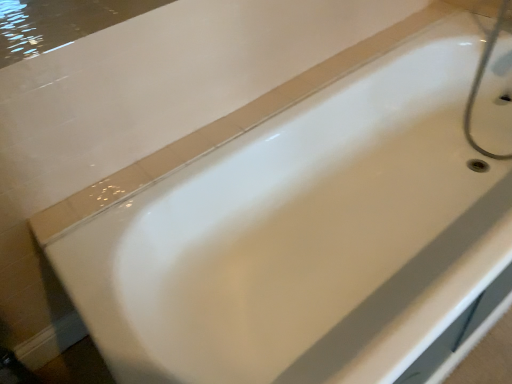
The image size is (512, 384). Find the location of `white glossy shower head at upper right`. white glossy shower head at upper right is located at coordinates (480, 82).

What do you see at coordinates (480, 82) in the screenshot? I see `white glossy shower head at upper right` at bounding box center [480, 82].

This screenshot has width=512, height=384. I want to click on white glossy shower head at upper right, so click(480, 82).